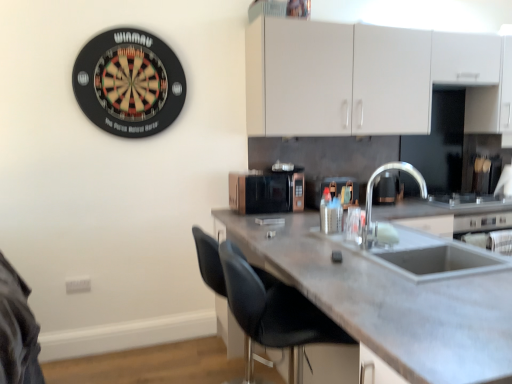
Question: Looking at their shapes, would you say black leather chair at lower center is wider or thinner than concrete gray countertop at center?

Choices:
 (A) wide
 (B) thin

Answer: (B)

Question: From a real-world perspective, relative to concrete gray countertop at center, is black leather chair at lower center vertically above or below?

Choices:
 (A) below
 (B) above

Answer: (B)

Question: Which object is positioned farthest from the satin nickel faucet at sink right?

Choices:
 (A) concrete gray countertop at center
 (B) metallic silver container at center, which is counted as the 2th appliance, starting from the left
 (C) rose gold metallic microwave at center, which is the 2th appliance in right-to-left order
 (D) black leather chair at lower center
 (E) white matte cabinet at upper center

Answer: (D)

Question: Estimate the real-world distances between objects in this image. Which object is farther from the black leather chair at lower center?

Choices:
 (A) satin nickel faucet at sink right
 (B) rose gold metallic microwave at center, the 1th appliance in the left-to-right sequence
 (C) white matte cabinet at upper center
 (D) concrete gray countertop at center
 (E) metallic silver container at center, positioned as the 1th appliance in right-to-left order

Answer: (C)